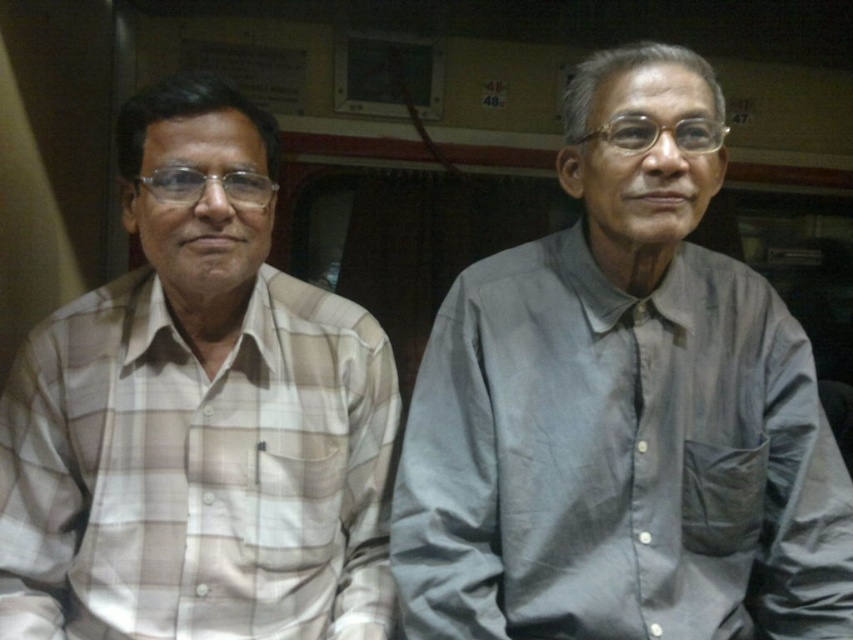
Question: Does gray cotton shirt at right appear on the right side of light beige plaid shirt at left?

Choices:
 (A) no
 (B) yes

Answer: (B)

Question: Is gray cotton shirt at right below light beige plaid shirt at left?

Choices:
 (A) yes
 (B) no

Answer: (B)

Question: Among these objects, which one is nearest to the camera?

Choices:
 (A) light beige plaid shirt at left
 (B) gray cotton shirt at right

Answer: (B)

Question: Considering the relative positions of gray cotton shirt at right and light beige plaid shirt at left in the image provided, where is gray cotton shirt at right located with respect to light beige plaid shirt at left?

Choices:
 (A) right
 (B) left

Answer: (A)